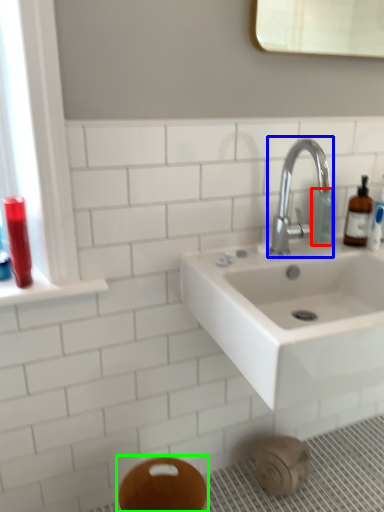
Question: Estimate the real-world distances between objects in this image. Which object is farther from toiletry (highlighted by a red box), tap (highlighted by a blue box) or bidet (highlighted by a green box)?

Choices:
 (A) tap
 (B) bidet

Answer: (B)